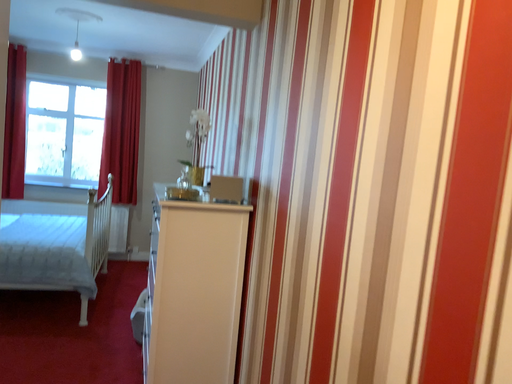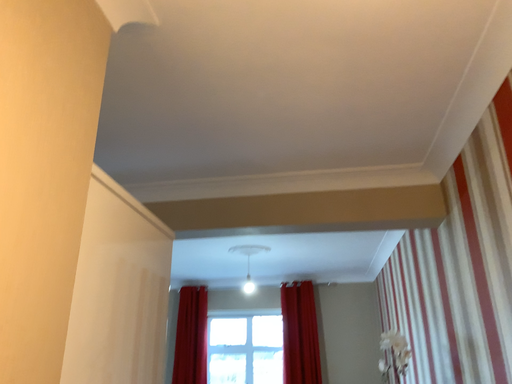
Question: How did the camera likely rotate when shooting the video?

Choices:
 (A) rotated right
 (B) rotated left

Answer: (B)